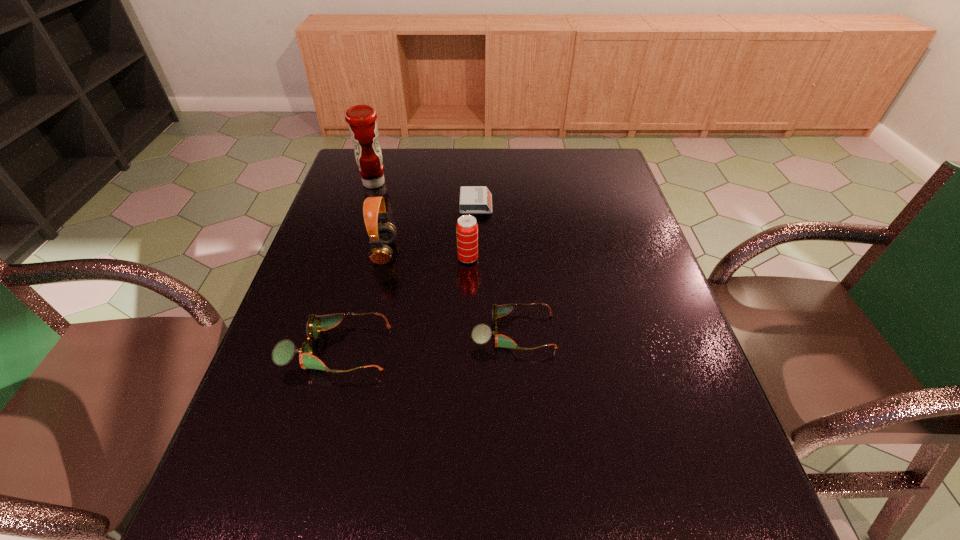
You are a GUI agent. You are given a task and a screenshot of the screen. Output one action in this format:
    pyautogui.click(x=<x>, y=<y>)
    Task: Click on the fourth tallest object
    This screenshot has height=540, width=960.
    Given the screenshot: What is the action you would take?
    pyautogui.click(x=283, y=352)

This screenshot has width=960, height=540. In order to click on the left spectacles in this screenshot , I will do `click(283, 352)`.

At what (x,y) coordinates should I click in order to perform the action: click on the right spectacles. Please return your answer as a coordinate pair (x, y). Looking at the image, I should click on (481, 334).

At what (x,y) coordinates should I click in order to perform the action: click on the shorter spectacles. Please return your answer as a coordinate pair (x, y). The image size is (960, 540). Looking at the image, I should click on (481, 334).

Where is `the tallest object`? the tallest object is located at coordinates (363, 128).

Locate an element on the screen. This screenshot has height=540, width=960. condiment is located at coordinates (363, 128).

Find the location of a particular element. The image size is (960, 540). the shortest object is located at coordinates (473, 199).

Identify the location of the fifth nearest object. The height and width of the screenshot is (540, 960). (473, 199).

Image resolution: width=960 pixels, height=540 pixels. What are the coordinates of `the second tallest object` in the screenshot? It's located at (374, 210).

In order to click on the fourth shortest object in this screenshot , I will do `click(466, 228)`.